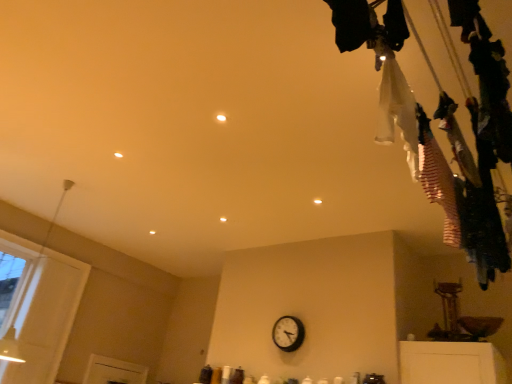
Question: Does black plastic wall clock at center have a smaller size compared to white fabric at upper right, placed as the 1th clothing when sorted from left to right?

Choices:
 (A) no
 (B) yes

Answer: (B)

Question: From the image's perspective, is black plastic wall clock at center on top of white fabric at upper right, placed as the 1th clothing when sorted from left to right?

Choices:
 (A) yes
 (B) no

Answer: (B)

Question: Is black plastic wall clock at center closer to camera compared to white fabric at upper right, placed as the 1th clothing when sorted from left to right?

Choices:
 (A) yes
 (B) no

Answer: (B)

Question: Would you consider black plastic wall clock at center to be distant from white fabric at upper right, the second clothing in the right-to-left sequence?

Choices:
 (A) yes
 (B) no

Answer: (A)

Question: Is black plastic wall clock at center completely or partially outside of white fabric at upper right, placed as the 1th clothing when sorted from left to right?

Choices:
 (A) no
 (B) yes

Answer: (B)

Question: From the image's perspective, is black plastic wall clock at center located beneath white fabric at upper right, the second clothing in the right-to-left sequence?

Choices:
 (A) no
 (B) yes

Answer: (B)

Question: Is white striped fabric at upper right, positioned as the 1th clothing in right-to-left order, beside white fabric at upper right, the second clothing in the right-to-left sequence?

Choices:
 (A) yes
 (B) no

Answer: (B)

Question: Is white striped fabric at upper right, the second clothing from the left, bigger than white fabric at upper right, placed as the 1th clothing when sorted from left to right?

Choices:
 (A) no
 (B) yes

Answer: (B)

Question: Is white striped fabric at upper right, positioned as the 1th clothing in right-to-left order, taller than white fabric at upper right, placed as the 1th clothing when sorted from left to right?

Choices:
 (A) yes
 (B) no

Answer: (B)

Question: From the image's perspective, is white striped fabric at upper right, positioned as the 1th clothing in right-to-left order, over white fabric at upper right, the second clothing in the right-to-left sequence?

Choices:
 (A) no
 (B) yes

Answer: (A)

Question: Can you confirm if white striped fabric at upper right, positioned as the 1th clothing in right-to-left order, is positioned to the right of white fabric at upper right, placed as the 1th clothing when sorted from left to right?

Choices:
 (A) no
 (B) yes

Answer: (B)

Question: Is white fabric at upper right, placed as the 1th clothing when sorted from left to right, located within white striped fabric at upper right, positioned as the 1th clothing in right-to-left order?

Choices:
 (A) yes
 (B) no

Answer: (B)

Question: Considering the relative sizes of black plastic wall clock at center and white striped fabric at upper right, positioned as the 1th clothing in right-to-left order, in the image provided, is black plastic wall clock at center thinner than white striped fabric at upper right, positioned as the 1th clothing in right-to-left order,?

Choices:
 (A) no
 (B) yes

Answer: (B)